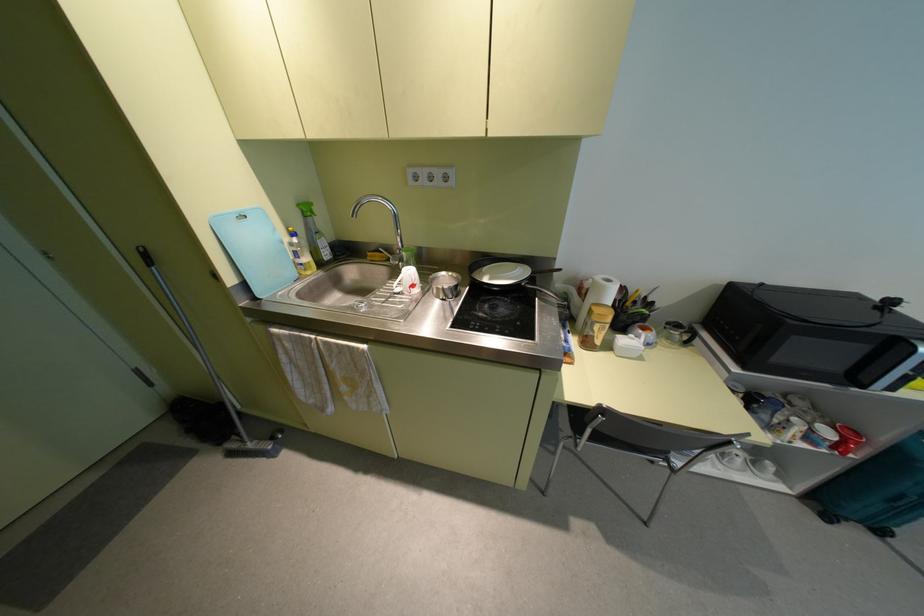
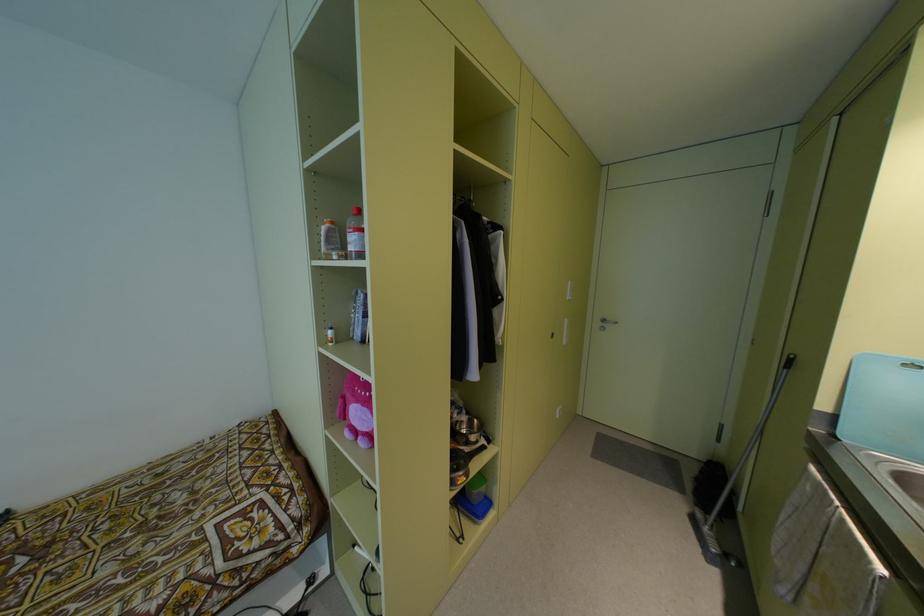
The first image is from the beginning of the video and the second image is from the end. How did the camera likely rotate when shooting the video?

The camera's rotation is toward left-down.